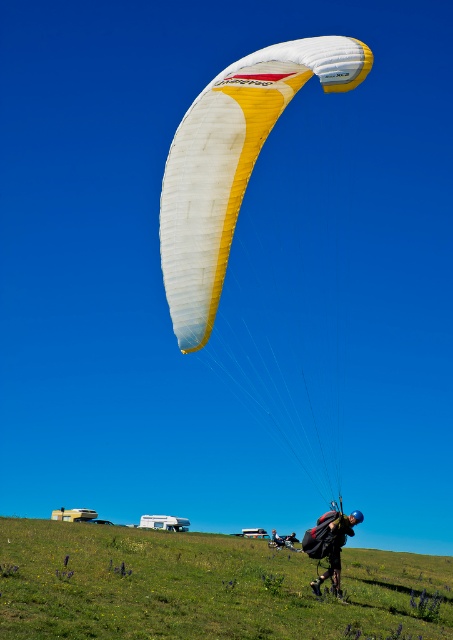
Question: Which object is positioned farthest from the green grassy field at lower center?

Choices:
 (A) dark blue fabric parachute at upper center
 (B) white/yellow fabric parachute at upper center

Answer: (B)

Question: Observing the image, what is the correct spatial positioning of green grassy field at lower center in reference to white/yellow fabric parachute at upper center?

Choices:
 (A) above
 (B) below

Answer: (B)

Question: Estimate the real-world distances between objects in this image. Which object is farther from the dark blue fabric parachute at upper center?

Choices:
 (A) green grassy field at lower center
 (B) white/yellow fabric parachute at upper center

Answer: (B)

Question: Is the position of green grassy field at lower center less distant than that of white/yellow fabric parachute at upper center?

Choices:
 (A) yes
 (B) no

Answer: (B)

Question: Is green grassy field at lower center positioned before dark blue fabric parachute at upper center?

Choices:
 (A) no
 (B) yes

Answer: (B)

Question: Which point is farther from the camera taking this photo?

Choices:
 (A) click(x=251, y=108)
 (B) click(x=337, y=529)
 (C) click(x=115, y=580)

Answer: (B)